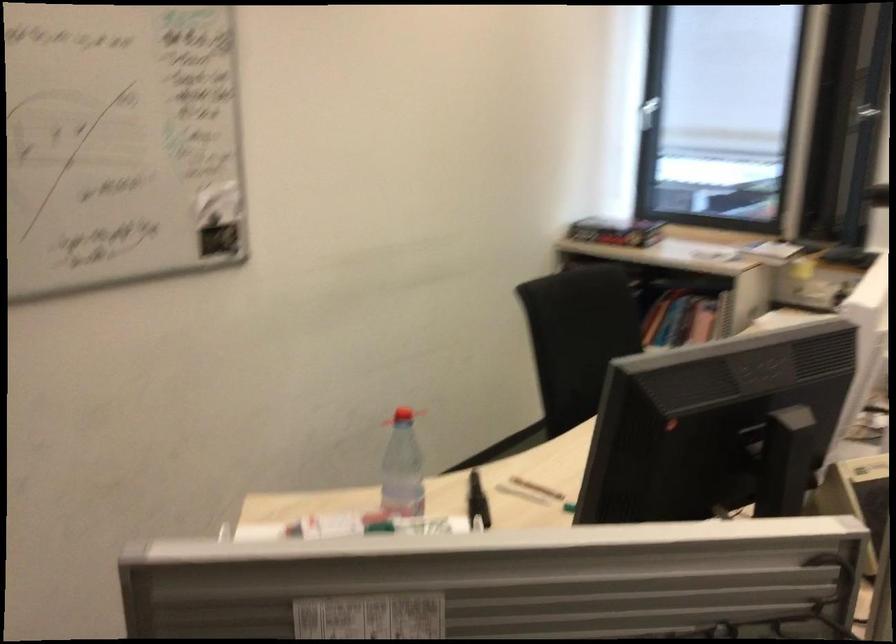
Which object does [401,469] point to?

This point indicates the plastic water bottle.